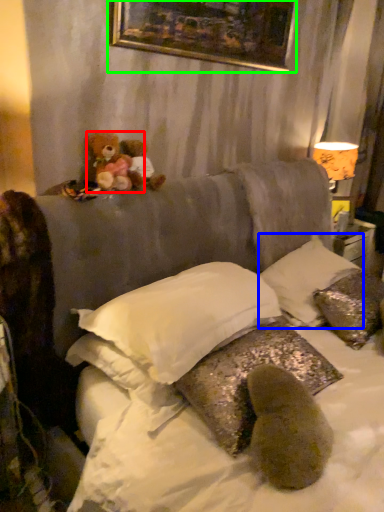
Question: Considering the real-world distances, which object is closest to teddy bear (highlighted by a red box)? pillow (highlighted by a blue box) or picture frame (highlighted by a green box).

Choices:
 (A) pillow
 (B) picture frame

Answer: (B)